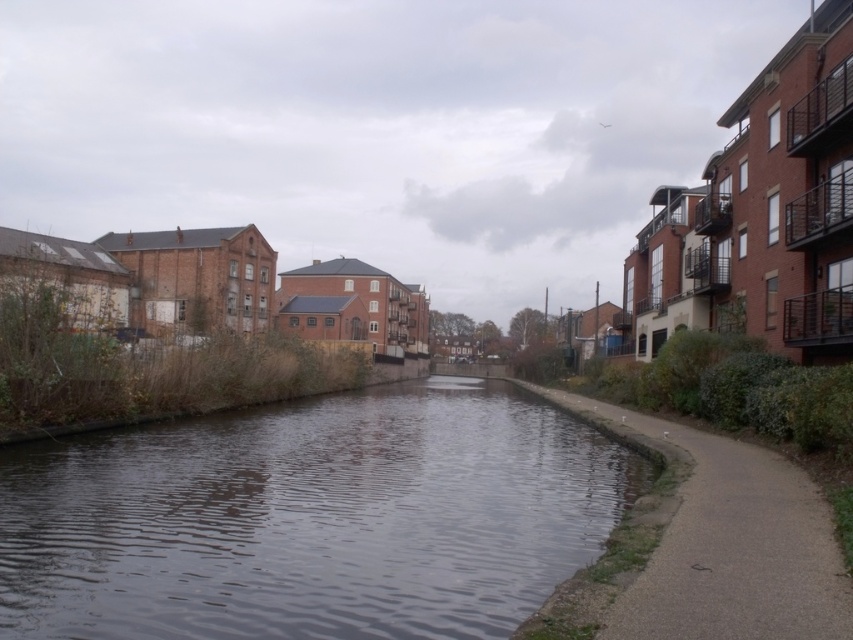
Question: Where is dark water at center located in relation to gray concrete pavement at lower right in the image?

Choices:
 (A) left
 (B) right

Answer: (A)

Question: From the image, what is the correct spatial relationship of dark water at center in relation to gray concrete pavement at lower right?

Choices:
 (A) right
 (B) left

Answer: (B)

Question: Is dark water at center behind gray concrete pavement at lower right?

Choices:
 (A) yes
 (B) no

Answer: (A)

Question: Among these points, which one is nearest to the camera?

Choices:
 (A) (509, 380)
 (B) (228, 465)

Answer: (B)

Question: Among these objects, which one is nearest to the camera?

Choices:
 (A) gray concrete pavement at lower right
 (B) dark water at center

Answer: (A)